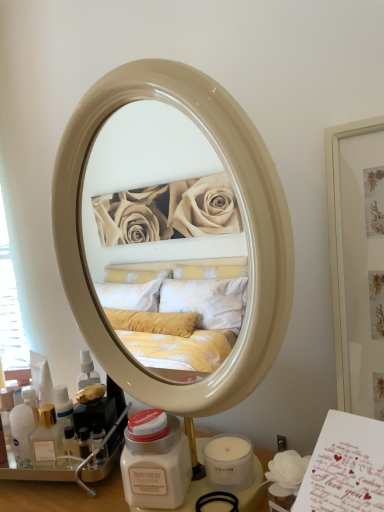
What is the approximate height of matte white jar at lower center?

It is 16.93 centimeters.

The width and height of the screenshot is (384, 512). Find the location of `matte white jar at lower center`. matte white jar at lower center is located at coordinates (62, 495).

Measure the distance between point (105,500) and camera.

24.02 inches.

Describe the element at coordinates (62, 495) in the screenshot. I see `matte white jar at lower center` at that location.

At what (x,y) coordinates should I click in order to perform the action: click on translucent plastic bottle at lower left. Please return your answer as a coordinate pair (x, y). This screenshot has height=512, width=384. Looking at the image, I should click on (23, 426).

The height and width of the screenshot is (512, 384). Describe the element at coordinates (23, 426) in the screenshot. I see `translucent plastic bottle at lower left` at that location.

Where is `matte white jar at lower center`? matte white jar at lower center is located at coordinates pyautogui.click(x=62, y=495).

Which object is positioned more to the right, translucent plastic bottle at lower left or matte white jar at lower center?

Positioned to the right is matte white jar at lower center.

Which is behind, translucent plastic bottle at lower left or matte white jar at lower center?

Positioned behind is translucent plastic bottle at lower left.

Which is behind, point (12, 419) or point (28, 505)?

The point (12, 419) is behind.

From the image's perspective, which is below, translucent plastic bottle at lower left or matte white jar at lower center?

From the image's view, translucent plastic bottle at lower left is below.

From a real-world perspective, between translucent plastic bottle at lower left and matte white jar at lower center, who is vertically lower?

translucent plastic bottle at lower left, from a real-world perspective.

Which of these two, translucent plastic bottle at lower left or matte white jar at lower center, is wider?

matte white jar at lower center is wider.

Which of these two, translucent plastic bottle at lower left or matte white jar at lower center, stands taller?

Standing taller between the two is matte white jar at lower center.

Looking at this image, does translucent plastic bottle at lower left have a smaller size compared to matte white jar at lower center?

Indeed, translucent plastic bottle at lower left has a smaller size compared to matte white jar at lower center.

Is translucent plastic bottle at lower left outside of matte white jar at lower center?

Yes, translucent plastic bottle at lower left is outside of matte white jar at lower center.

Is translucent plastic bottle at lower left next to matte white jar at lower center?

No, translucent plastic bottle at lower left is not next to matte white jar at lower center.

Is translucent plastic bottle at lower left oriented towards matte white jar at lower center?

No, translucent plastic bottle at lower left is not oriented towards matte white jar at lower center.

How different are the orientations of translucent plastic bottle at lower left and matte white jar at lower center in degrees?

translucent plastic bottle at lower left and matte white jar at lower center are facing 7.55 degrees away from each other.

How far apart are translucent plastic bottle at lower left and matte white jar at lower center?

They are 4.35 inches apart.

Locate an element on the screen. vanity in front of the translucent plastic bottle at lower left is located at coordinates (62, 495).

Is matte white jar at lower center at the left side of translucent plastic bottle at lower left?

Incorrect, matte white jar at lower center is not on the left side of translucent plastic bottle at lower left.

Does matte white jar at lower center come behind translucent plastic bottle at lower left?

No, matte white jar at lower center is closer to the camera.

Does point (255, 452) come in front of point (27, 423)?

That is False.

From the image's perspective, is matte white jar at lower center above or below translucent plastic bottle at lower left?

From the image's perspective, matte white jar at lower center appears above translucent plastic bottle at lower left.

From a real-world perspective, is matte white jar at lower center positioned under translucent plastic bottle at lower left based on gravity?

Incorrect, from a real-world perspective, matte white jar at lower center is higher than translucent plastic bottle at lower left.

Does matte white jar at lower center have a lesser width compared to translucent plastic bottle at lower left?

Incorrect, the width of matte white jar at lower center is not less than that of translucent plastic bottle at lower left.

Considering the sizes of objects matte white jar at lower center and translucent plastic bottle at lower left in the image provided, who is shorter, matte white jar at lower center or translucent plastic bottle at lower left?

translucent plastic bottle at lower left is shorter.

Considering the relative sizes of matte white jar at lower center and translucent plastic bottle at lower left in the image provided, is matte white jar at lower center smaller than translucent plastic bottle at lower left?

No, matte white jar at lower center is not smaller than translucent plastic bottle at lower left.

Would you say matte white jar at lower center is inside or outside translucent plastic bottle at lower left?

matte white jar at lower center is spatially situated outside translucent plastic bottle at lower left.

From the picture: Is matte white jar at lower center next to translucent plastic bottle at lower left and touching it?

No, matte white jar at lower center is not in contact with translucent plastic bottle at lower left.

Consider the image. Is matte white jar at lower center turned away from translucent plastic bottle at lower left?

That's not correct — matte white jar at lower center is not looking away from translucent plastic bottle at lower left.

How different are the orientations of matte white jar at lower center and translucent plastic bottle at lower left in degrees?

There is a 7.55-degree angle between the facing directions of matte white jar at lower center and translucent plastic bottle at lower left.

How much distance is there between matte white jar at lower center and translucent plastic bottle at lower left?

matte white jar at lower center is 11.06 centimeters away from translucent plastic bottle at lower left.

Identify the location of toiletry behind the matte white jar at lower center. Image resolution: width=384 pixels, height=512 pixels. (23, 426).

The image size is (384, 512). Find the location of `toiletry that appears below the matte white jar at lower center (from the image's perspective)`. toiletry that appears below the matte white jar at lower center (from the image's perspective) is located at coordinates (23, 426).

This screenshot has height=512, width=384. I want to click on toiletry lying behind the matte white jar at lower center, so click(23, 426).